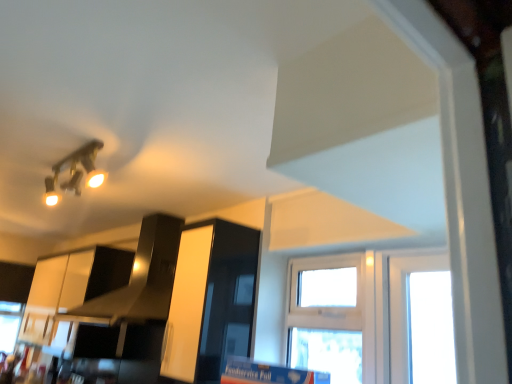
Question: Choose the correct answer: Is white plastic window at center inside black glossy exhaust hood at upper center or outside it?

Choices:
 (A) inside
 (B) outside

Answer: (B)

Question: Is point (356, 362) positioned closer to the camera than point (134, 256)?

Choices:
 (A) closer
 (B) farther

Answer: (A)

Question: Which of these objects is positioned farthest from the matte gold light fixture at upper left?

Choices:
 (A) white plastic window at center
 (B) glossy white cabinet at center
 (C) black glossy exhaust hood at upper center

Answer: (A)

Question: Estimate the real-world distances between objects in this image. Which object is closer to the matte gold light fixture at upper left?

Choices:
 (A) white plastic window at center
 (B) black glossy exhaust hood at upper center
 (C) glossy white cabinet at center

Answer: (B)